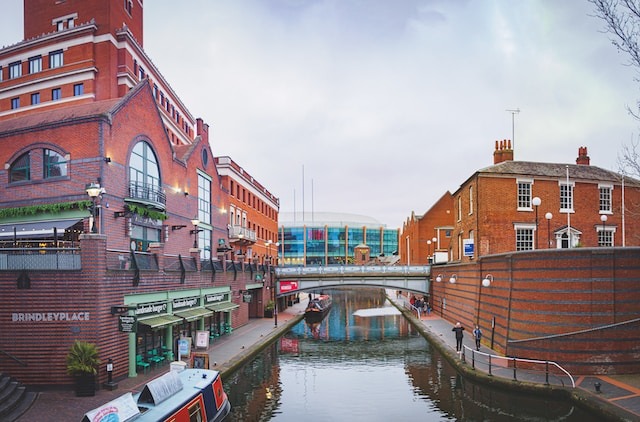
The image size is (640, 422). I want to click on windows, so click(146, 171), click(204, 196).